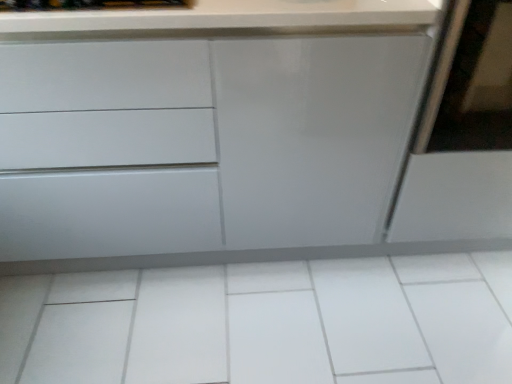
Question: Does matte white screen door at right have a lesser height compared to white glossy tile at center?

Choices:
 (A) yes
 (B) no

Answer: (B)

Question: Could you tell me if matte white screen door at right is turned towards white glossy tile at center?

Choices:
 (A) no
 (B) yes

Answer: (A)

Question: From a real-world perspective, does matte white screen door at right sit lower than white glossy tile at center?

Choices:
 (A) yes
 (B) no

Answer: (B)

Question: Is matte white screen door at right at the left side of white glossy tile at center?

Choices:
 (A) no
 (B) yes

Answer: (A)

Question: Is matte white screen door at right not close to white glossy tile at center?

Choices:
 (A) no
 (B) yes

Answer: (A)

Question: Is matte white screen door at right positioned beyond the bounds of white glossy tile at center?

Choices:
 (A) yes
 (B) no

Answer: (A)

Question: Can you confirm if matte white cabinet at center is smaller than matte white screen door at right?

Choices:
 (A) no
 (B) yes

Answer: (A)

Question: Is matte white cabinet at center not near matte white screen door at right?

Choices:
 (A) no
 (B) yes

Answer: (A)

Question: Is the position of matte white cabinet at center less distant than that of matte white screen door at right?

Choices:
 (A) yes
 (B) no

Answer: (A)

Question: Is matte white screen door at right at the back of matte white cabinet at center?

Choices:
 (A) no
 (B) yes

Answer: (A)

Question: From a real-world perspective, is matte white cabinet at center under matte white screen door at right?

Choices:
 (A) yes
 (B) no

Answer: (A)

Question: Is matte white screen door at right located within matte white cabinet at center?

Choices:
 (A) no
 (B) yes

Answer: (A)

Question: Is matte white cabinet at center far from white glossy tile at center?

Choices:
 (A) yes
 (B) no

Answer: (B)